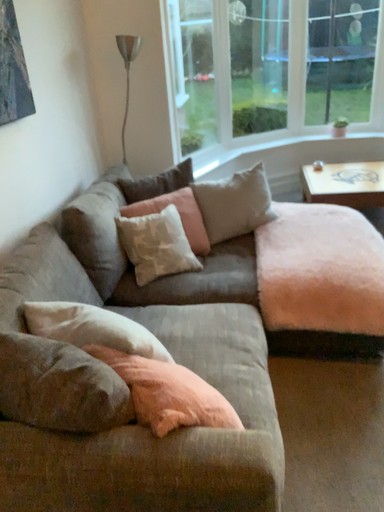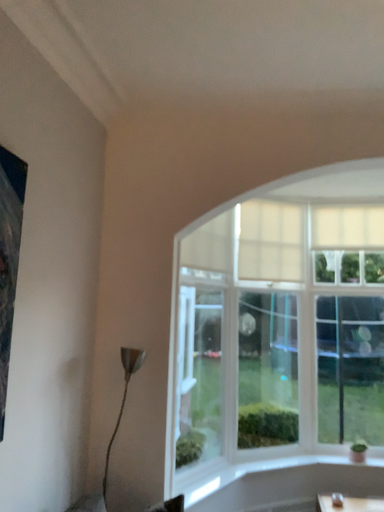
Question: How did the camera likely rotate when shooting the video?

Choices:
 (A) rotated downward
 (B) rotated upward

Answer: (B)